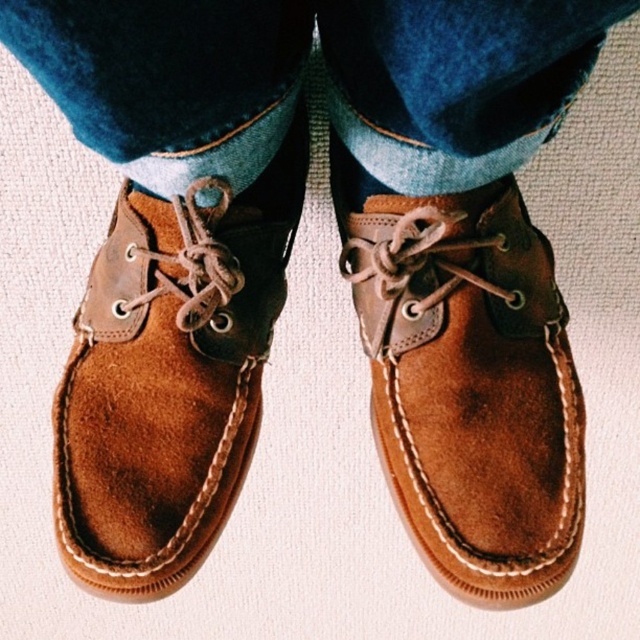
Question: Is denim at center further to the viewer compared to brown suede shoe at center?

Choices:
 (A) no
 (B) yes

Answer: (A)

Question: Which object is the farthest from the brown suede shoe at center?

Choices:
 (A) suede brown shoe at center
 (B) denim at center

Answer: (A)

Question: Can you confirm if denim at center is positioned above suede brown shoe at center?

Choices:
 (A) yes
 (B) no

Answer: (A)

Question: Does denim at center have a greater width compared to brown suede shoe at center?

Choices:
 (A) no
 (B) yes

Answer: (B)

Question: Which of these objects is positioned closest to the brown suede shoe at center?

Choices:
 (A) denim at center
 (B) suede brown shoe at center

Answer: (A)

Question: Which object is farther from the camera taking this photo?

Choices:
 (A) brown suede shoe at center
 (B) denim at center

Answer: (A)